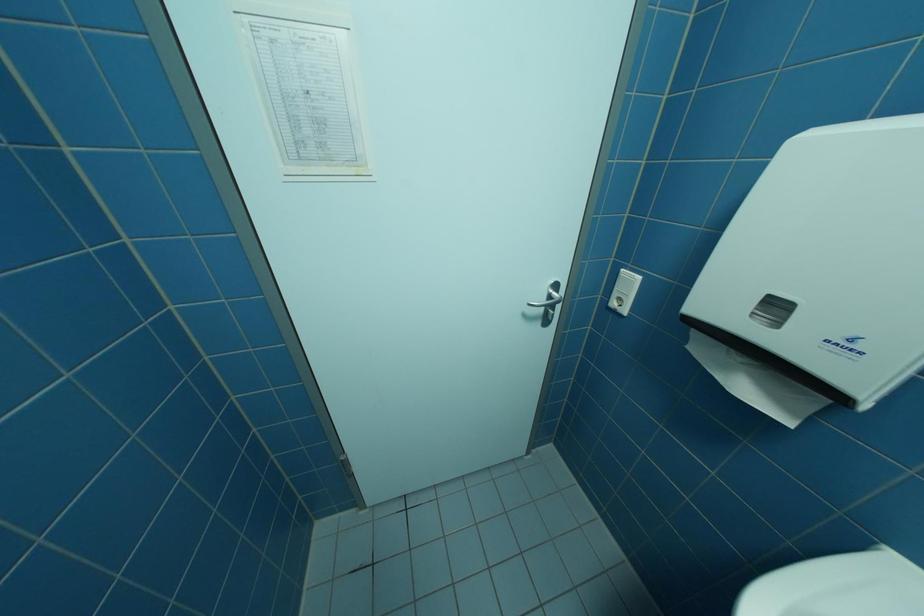
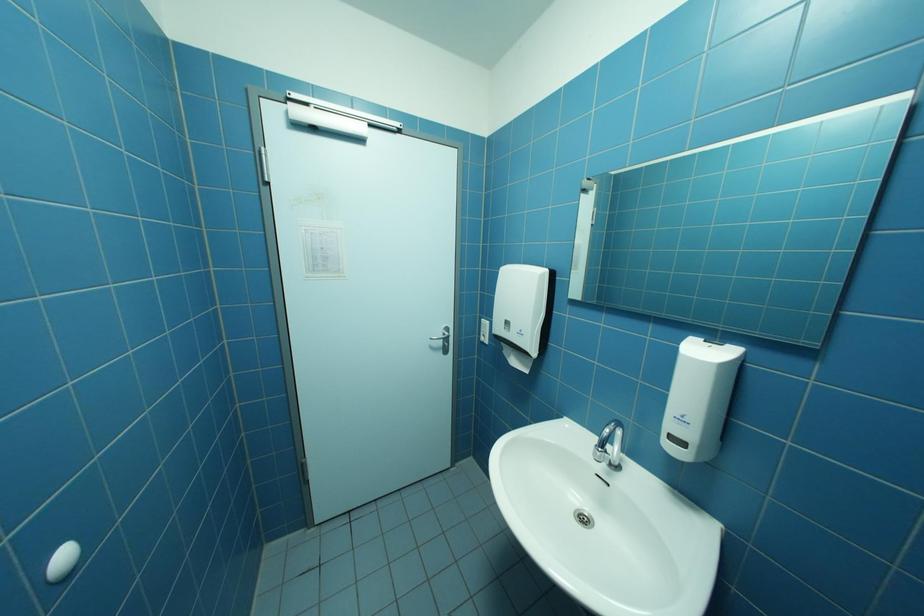
Question: What movement of the cameraman would produce the second image?

Choices:
 (A) Left
 (B) Right
 (C) Forward
 (D) Backward

Answer: (D)